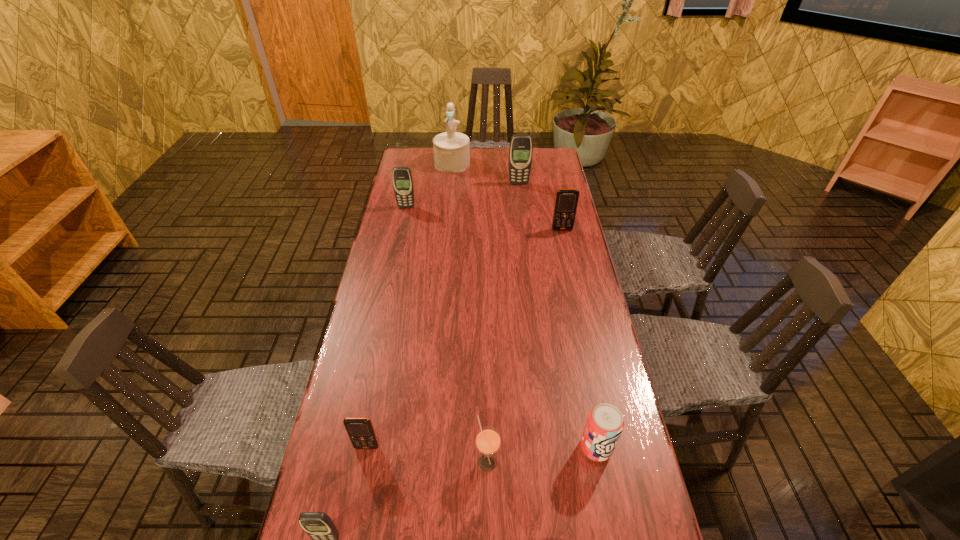
The image size is (960, 540). I want to click on figurine that is at the left edge, so click(451, 149).

Locate an element on the screen. This screenshot has height=540, width=960. soda can that is at the right edge is located at coordinates (604, 425).

This screenshot has width=960, height=540. I want to click on object located at the far left corner, so click(x=451, y=149).

Image resolution: width=960 pixels, height=540 pixels. Find the location of `vacant space at the far edge`. vacant space at the far edge is located at coordinates (x=498, y=153).

You are a GUI agent. You are given a task and a screenshot of the screen. Output one action in this format:
    pyautogui.click(x=<x>, y=<y>)
    Task: Click on the vacant space at the left edge
    
    Given the screenshot: What is the action you would take?
    pyautogui.click(x=420, y=248)

Image resolution: width=960 pixels, height=540 pixels. I want to click on free location at the right edge, so click(x=583, y=261).

Locate an element on the screen. Image resolution: width=960 pixels, height=540 pixels. free location at the far left corner is located at coordinates (434, 168).

This screenshot has height=540, width=960. I want to click on free space at the far right corner, so click(546, 172).

In order to click on free area in between the smaller orange cellular telephone and the second tallest object in this screenshot , I will do `click(443, 315)`.

This screenshot has height=540, width=960. Identify the location of unoccupied area between the fourth object from right to left and the soda can. (541, 455).